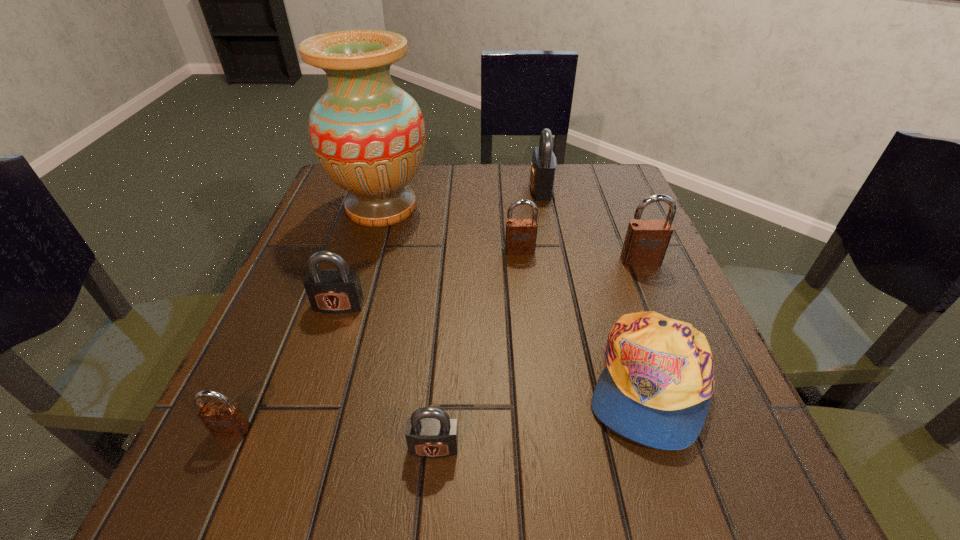
Identify the location of the fourth object from left to right. This screenshot has height=540, width=960. (430, 433).

You are a GUI agent. You are given a task and a screenshot of the screen. Output one action in this format:
    pyautogui.click(x=<x>, y=<y>)
    Task: Click on the third padlock from left to right
    
    Given the screenshot: What is the action you would take?
    pyautogui.click(x=430, y=433)

The height and width of the screenshot is (540, 960). Identify the location of the smallest brown padlock. (226, 418).

Image resolution: width=960 pixels, height=540 pixels. Identify the location of the leftmost brown padlock. (226, 418).

Find the location of a particular element. The height and width of the screenshot is (540, 960). vacant space situated on the right of the tallest object is located at coordinates (532, 207).

Locate an element on the screen. free space located 0.170m on the front of the farthest padlock near the keyhole is located at coordinates (459, 189).

I want to click on free space located on the front of the farthest padlock near the keyhole, so click(x=438, y=189).

Locate an element on the screen. Image resolution: width=960 pixels, height=540 pixels. vacant space located 0.090m on the front of the farthest padlock near the keyhole is located at coordinates (492, 189).

Locate an element on the screen. free region located 0.090m on the front-facing side of the third farthest padlock is located at coordinates (657, 299).

Where is `vacant region located on the front-facing side of the second brown padlock from right to left`? vacant region located on the front-facing side of the second brown padlock from right to left is located at coordinates click(533, 376).